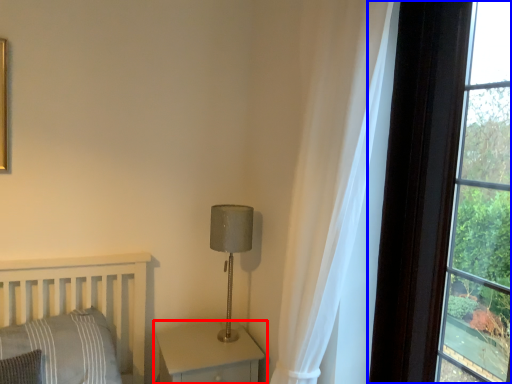
Question: Which point is closer to the camera, nightstand (highlighted by a red box) or window (highlighted by a blue box)?

Choices:
 (A) nightstand
 (B) window

Answer: (B)